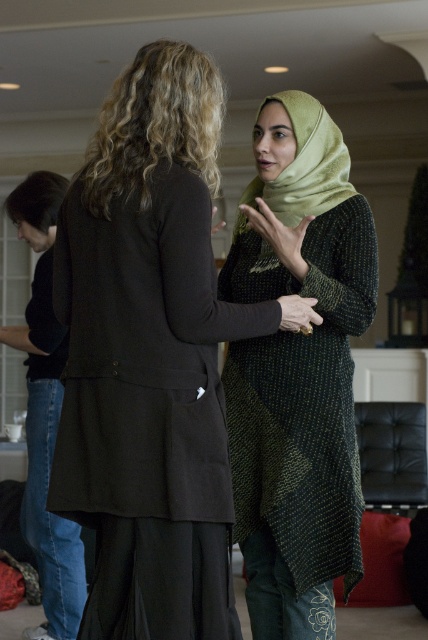
Who is lower down, green textured hijab at center or green silk hijab at center?

green textured hijab at center is below.

Between point (276, 611) and point (287, 196), which one is positioned behind?

The point (287, 196) is behind.

Where is `green textured hijab at center`? The image size is (428, 640). green textured hijab at center is located at coordinates (297, 371).

Image resolution: width=428 pixels, height=640 pixels. In order to click on matte black coat at center in this screenshot , I will do tap(151, 356).

Is matte black coat at center positioned at the back of green silk hijab at center?

No, matte black coat at center is in front of green silk hijab at center.

Does point (89, 198) lie in front of point (241, 218)?

Yes, point (89, 198) is closer to viewer.

The width and height of the screenshot is (428, 640). I want to click on matte black coat at center, so click(151, 356).

Does matte black coat at center have a lesser width compared to green textured hijab at center?

Incorrect, matte black coat at center's width is not less than green textured hijab at center's.

What do you see at coordinates (151, 356) in the screenshot? This screenshot has height=640, width=428. I see `matte black coat at center` at bounding box center [151, 356].

The height and width of the screenshot is (640, 428). In order to click on matte black coat at center in this screenshot , I will do `click(151, 356)`.